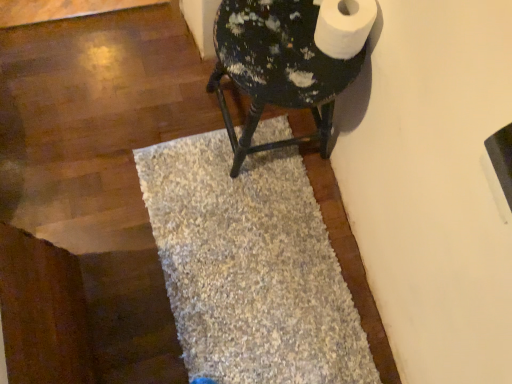
At what (x,y) coordinates should I click in order to perform the action: click on painted wood stool at upper right. Please return your answer as a coordinate pair (x, y). Looking at the image, I should click on (277, 68).

This screenshot has height=384, width=512. Describe the element at coordinates (343, 26) in the screenshot. I see `white matte toilet paper at upper right` at that location.

The width and height of the screenshot is (512, 384). Describe the element at coordinates (250, 267) in the screenshot. I see `beige shaggy bath mat at center` at that location.

Where is `painted wood stool at upper right`? painted wood stool at upper right is located at coordinates (277, 68).

From a real-world perspective, is painted wood stool at upper right on top of beige shaggy bath mat at center?

Yes, from a real-world perspective, painted wood stool at upper right is above beige shaggy bath mat at center.

Consider the image. Is painted wood stool at upper right far from beige shaggy bath mat at center?

painted wood stool at upper right is actually quite close to beige shaggy bath mat at center.

What's the angular difference between painted wood stool at upper right and beige shaggy bath mat at center's facing directions?

The angular difference between painted wood stool at upper right and beige shaggy bath mat at center is 87.9 degrees.

From the picture: From a real-world perspective, which object rests below the other?

From a 3D spatial view, painted wood stool at upper right is below.

Between white matte toilet paper at upper right and painted wood stool at upper right, which one has smaller width?

With smaller width is white matte toilet paper at upper right.

Considering the relative positions of white matte toilet paper at upper right and painted wood stool at upper right in the image provided, is white matte toilet paper at upper right to the left of painted wood stool at upper right from the viewer's perspective?

Incorrect, white matte toilet paper at upper right is not on the left side of painted wood stool at upper right.

Considering the sizes of objects beige shaggy bath mat at center and painted wood stool at upper right in the image provided, who is smaller, beige shaggy bath mat at center or painted wood stool at upper right?

beige shaggy bath mat at center is smaller.

From a real-world perspective, is beige shaggy bath mat at center below painted wood stool at upper right?

Yes, from a real-world perspective, beige shaggy bath mat at center is below painted wood stool at upper right.

Is painted wood stool at upper right located within beige shaggy bath mat at center?

No, painted wood stool at upper right is located outside of beige shaggy bath mat at center.

Can you see beige shaggy bath mat at center touching painted wood stool at upper right?

No, beige shaggy bath mat at center is not touching painted wood stool at upper right.

Would you consider beige shaggy bath mat at center to be distant from white matte toilet paper at upper right?

beige shaggy bath mat at center is actually quite close to white matte toilet paper at upper right.

From the image's perspective, which is below, beige shaggy bath mat at center or white matte toilet paper at upper right?

beige shaggy bath mat at center, from the image's perspective.

Is beige shaggy bath mat at center turned away from white matte toilet paper at upper right?

No.

Considering the positions of points (325, 304) and (321, 24), is point (325, 304) closer to camera compared to point (321, 24)?

No, it is behind (321, 24).

From the image's perspective, is painted wood stool at upper right positioned above or below white matte toilet paper at upper right?

Based on their image positions, painted wood stool at upper right is located beneath white matte toilet paper at upper right.

Is painted wood stool at upper right in front of white matte toilet paper at upper right?

No, painted wood stool at upper right is behind white matte toilet paper at upper right.

Is painted wood stool at upper right thinner than white matte toilet paper at upper right?

In fact, painted wood stool at upper right might be wider than white matte toilet paper at upper right.

Is painted wood stool at upper right positioned with its back to white matte toilet paper at upper right?

No, painted wood stool at upper right is not facing the opposite direction of white matte toilet paper at upper right.

Between white matte toilet paper at upper right and beige shaggy bath mat at center, which one appears on the right side from the viewer's perspective?

white matte toilet paper at upper right.

Does white matte toilet paper at upper right lie behind beige shaggy bath mat at center?

No, it is not.

Who is taller, white matte toilet paper at upper right or beige shaggy bath mat at center?

white matte toilet paper at upper right is taller.

From the image's perspective, would you say white matte toilet paper at upper right is positioned over beige shaggy bath mat at center?

Indeed, from the image's perspective, white matte toilet paper at upper right is shown above beige shaggy bath mat at center.

Where is `furniture on the right of beige shaggy bath mat at center`? The image size is (512, 384). furniture on the right of beige shaggy bath mat at center is located at coordinates (277, 68).

Where is `furniture behind the white matte toilet paper at upper right`? furniture behind the white matte toilet paper at upper right is located at coordinates (277, 68).

From the image, which object appears to be nearer to beige shaggy bath mat at center, painted wood stool at upper right or white matte toilet paper at upper right?

painted wood stool at upper right.

Estimate the real-world distances between objects in this image. Which object is closer to painted wood stool at upper right, white matte toilet paper at upper right or beige shaggy bath mat at center?

Among the two, white matte toilet paper at upper right is located nearer to painted wood stool at upper right.

Based on their spatial positions, is white matte toilet paper at upper right or painted wood stool at upper right further from beige shaggy bath mat at center?

Among the two, white matte toilet paper at upper right is located further to beige shaggy bath mat at center.

Based on their spatial positions, is painted wood stool at upper right or beige shaggy bath mat at center further from white matte toilet paper at upper right?

The object further to white matte toilet paper at upper right is beige shaggy bath mat at center.

Which object lies nearer to the anchor point white matte toilet paper at upper right, beige shaggy bath mat at center or painted wood stool at upper right?

The object closer to white matte toilet paper at upper right is painted wood stool at upper right.

Based on their spatial positions, is beige shaggy bath mat at center or white matte toilet paper at upper right further from painted wood stool at upper right?

beige shaggy bath mat at center.

What are the coordinates of `furniture between white matte toilet paper at upper right and beige shaggy bath mat at center in the vertical direction` in the screenshot? It's located at tap(277, 68).